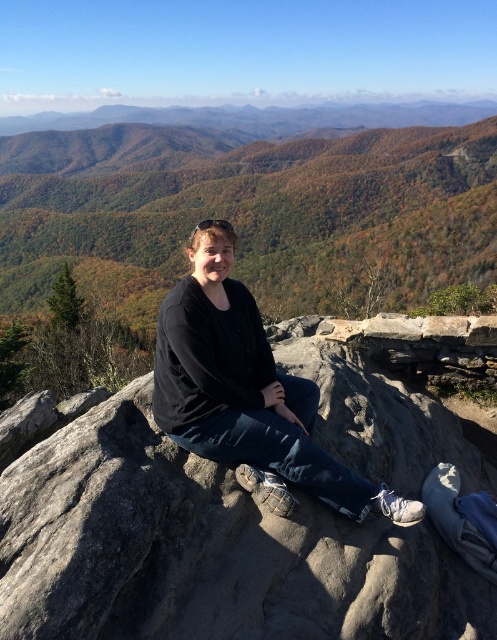
Is gray rough rock at center thinner than black matte shirt at center?

Incorrect, gray rough rock at center's width is not less than black matte shirt at center's.

The width and height of the screenshot is (497, 640). Find the location of `gray rough rock at center`. gray rough rock at center is located at coordinates (204, 550).

Is point (7, 515) more distant than point (357, 506)?

No, (7, 515) is in front of (357, 506).

Find the location of a particular element. Image resolution: width=497 pixels, height=640 pixels. gray rough rock at center is located at coordinates (204, 550).